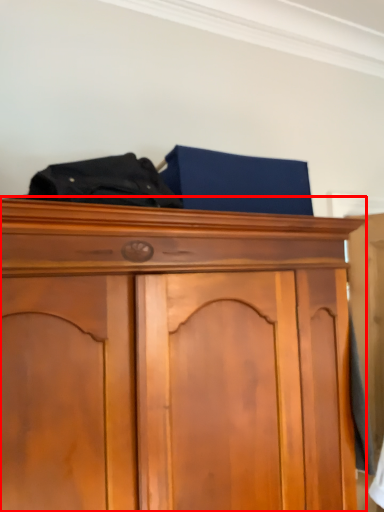
Question: From the image's perspective, what is the correct spatial positioning of cupboard (annotated by the red box) in reference to underclothes?

Choices:
 (A) above
 (B) below

Answer: (B)